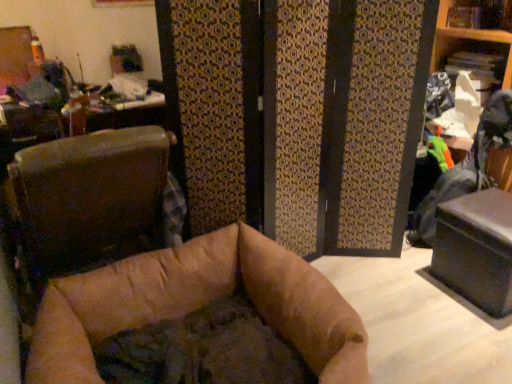
What do you see at coordinates (476, 249) in the screenshot?
I see `black matte table at lower right` at bounding box center [476, 249].

You are a GUI agent. You are given a task and a screenshot of the screen. Output one action in this format:
    pyautogui.click(x=<x>, y=<y>)
    Task: Click on the black matte table at lower right
    Image resolution: width=512 pixels, height=384 pixels.
    Given the screenshot: What is the action you would take?
    pyautogui.click(x=476, y=249)

At what (x,y) coordinates should I click in order to perform the action: click on brown leather chair at left. Please return your answer as a coordinate pair (x, y). Image resolution: width=512 pixels, height=384 pixels. Looking at the image, I should click on (87, 204).

Describe the element at coordinates (87, 204) in the screenshot. This screenshot has height=384, width=512. I see `brown leather chair at left` at that location.

You are a GUI agent. You are given a task and a screenshot of the screen. Output one action in this format:
    pyautogui.click(x=<x>, y=<y>)
    Task: Click on the black matte table at lower right
    This screenshot has width=512, height=384.
    Given the screenshot: What is the action you would take?
    pyautogui.click(x=476, y=249)

Considering the relative positions of black matte table at lower right and brown leather chair at left in the image provided, is black matte table at lower right to the left of brown leather chair at left from the viewer's perspective?

Incorrect, black matte table at lower right is not on the left side of brown leather chair at left.

Considering the relative positions of black matte table at lower right and brown leather chair at left in the image provided, is black matte table at lower right in front of brown leather chair at left?

No, it is not.

Is point (497, 312) less distant than point (114, 216)?

No, it is not.

From the image's perspective, is black matte table at lower right located above or below brown leather chair at left?

black matte table at lower right is below brown leather chair at left.

From a real-world perspective, is black matte table at lower right below brown leather chair at left?

Correct, in the physical world, black matte table at lower right is lower than brown leather chair at left.

Is black matte table at lower right thinner than brown leather chair at left?

Incorrect, the width of black matte table at lower right is not less than that of brown leather chair at left.

Looking at this image, which of these two, black matte table at lower right or brown leather chair at left, stands shorter?

With less height is black matte table at lower right.

Can you confirm if black matte table at lower right is bigger than brown leather chair at left?

No, black matte table at lower right is not bigger than brown leather chair at left.

Is black matte table at lower right not inside brown leather chair at left?

Yes.

Is black matte table at lower right not close to brown leather chair at left?

That's right, there is a large distance between black matte table at lower right and brown leather chair at left.

Is black matte table at lower right turned away from brown leather chair at left?

No, black matte table at lower right is not facing away from brown leather chair at left.

Find the location of a particular element. The image size is (512, 384). furniture that appears in front of the black matte table at lower right is located at coordinates (87, 204).

Considering the relative positions of brown leather chair at left and black matte table at lower right in the image provided, is brown leather chair at left to the left of black matte table at lower right from the viewer's perspective?

Yes, brown leather chair at left is to the left of black matte table at lower right.

Which object is further away from the camera, brown leather chair at left or black matte table at lower right?

black matte table at lower right is behind.

Which is closer to the camera, (36, 259) or (497, 223)?

Point (36, 259) appears to be closer to the viewer than point (497, 223).

From the image's perspective, is brown leather chair at left under black matte table at lower right?

No, from the image's perspective, brown leather chair at left is not beneath black matte table at lower right.

From a real-world perspective, which is physically above, brown leather chair at left or black matte table at lower right?

In real-world perspective, brown leather chair at left is above.

Based on the photo, which object is thinner, brown leather chair at left or black matte table at lower right?

Thinner between the two is brown leather chair at left.

Considering the sizes of objects brown leather chair at left and black matte table at lower right in the image provided, who is shorter, brown leather chair at left or black matte table at lower right?

black matte table at lower right.

Which of these two, brown leather chair at left or black matte table at lower right, is bigger?

Bigger between the two is brown leather chair at left.

Would you say black matte table at lower right is part of brown leather chair at left's contents?

No.

Is brown leather chair at left not near black matte table at lower right?

brown leather chair at left is far away from black matte table at lower right.

Could you tell me if brown leather chair at left is turned towards black matte table at lower right?

No, brown leather chair at left does not turn towards black matte table at lower right.

Can you tell me how much brown leather chair at left and black matte table at lower right differ in facing direction?

173 degrees separate the facing orientations of brown leather chair at left and black matte table at lower right.

At what (x,y) coordinates should I click in order to perform the action: click on table below the brown leather chair at left (from a real-world perspective). Please return your answer as a coordinate pair (x, y). Image resolution: width=512 pixels, height=384 pixels. Looking at the image, I should click on (476, 249).

The height and width of the screenshot is (384, 512). Identify the location of furniture in front of the black matte table at lower right. (87, 204).

Find the location of a particular element. table below the brown leather chair at left (from a real-world perspective) is located at coordinates (476, 249).